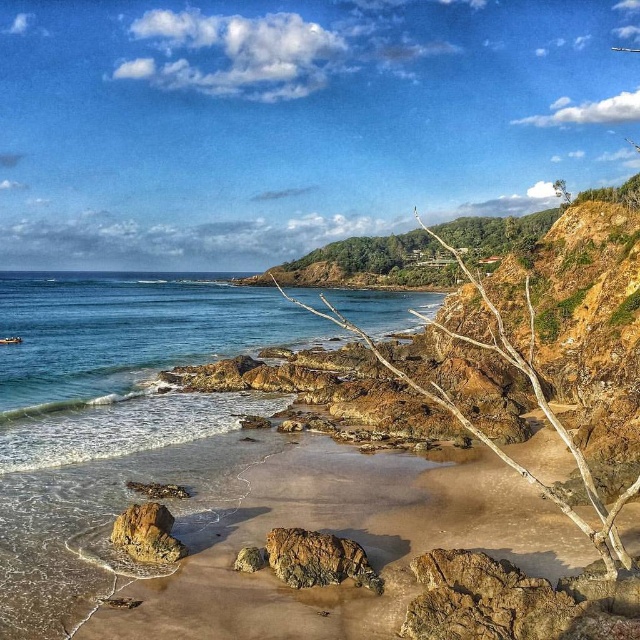
Question: Based on their relative distances, which object is nearer to the rusty metallic rock at center?

Choices:
 (A) rusty rock at center
 (B) rusty rock at lower left

Answer: (A)

Question: Among these points, which one is nearest to the camera?

Choices:
 (A) (141, 548)
 (B) (292, 548)
 (C) (264, 557)

Answer: (B)

Question: Which point is farther to the camera?

Choices:
 (A) (273, 532)
 (B) (252, 547)

Answer: (B)

Question: Does rusty rock at center appear under rusty metallic rock at center?

Choices:
 (A) yes
 (B) no

Answer: (A)

Question: Is rusty rock at lower left wider than rusty metallic rock at center?

Choices:
 (A) yes
 (B) no

Answer: (A)

Question: Does rusty rock at center come in front of rusty rock at lower left?

Choices:
 (A) yes
 (B) no

Answer: (A)